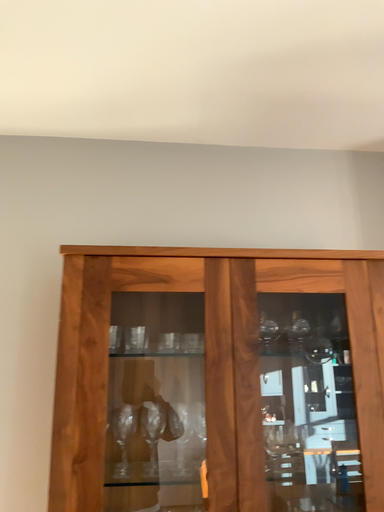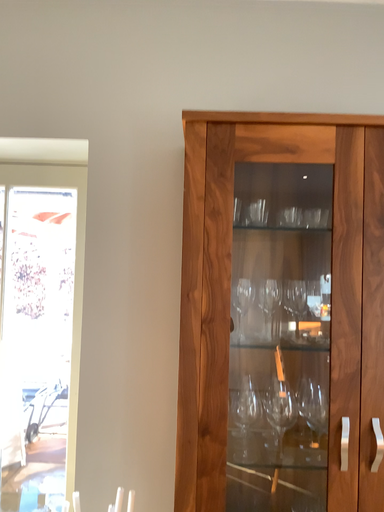
Question: Which way did the camera rotate in the video?

Choices:
 (A) rotated upward
 (B) rotated downward

Answer: (B)